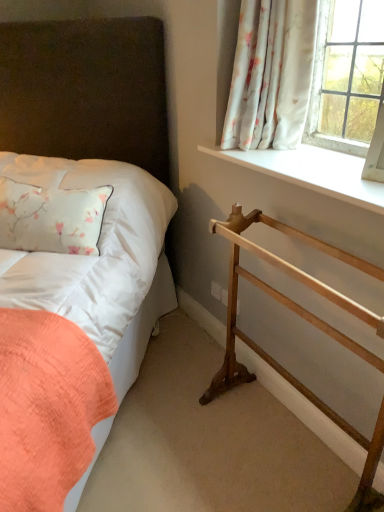
Question: In the image, is matte white bed at left positioned in front of or behind white satin pillow at left?

Choices:
 (A) behind
 (B) front

Answer: (B)

Question: Would you say matte white bed at left is to the left or to the right of white satin pillow at left in the picture?

Choices:
 (A) left
 (B) right

Answer: (A)

Question: Based on their relative distances, which object is farther from the white satin pillow at left?

Choices:
 (A) wooden towel rack at lower right
 (B) white floral fabric at upper right
 (C) matte white bed at left
 (D) white smooth window sill at upper right

Answer: (B)

Question: Based on their relative distances, which object is nearer to the wooden towel rack at lower right?

Choices:
 (A) white smooth window sill at upper right
 (B) white satin pillow at left
 (C) matte white bed at left
 (D) white floral fabric at upper right

Answer: (A)